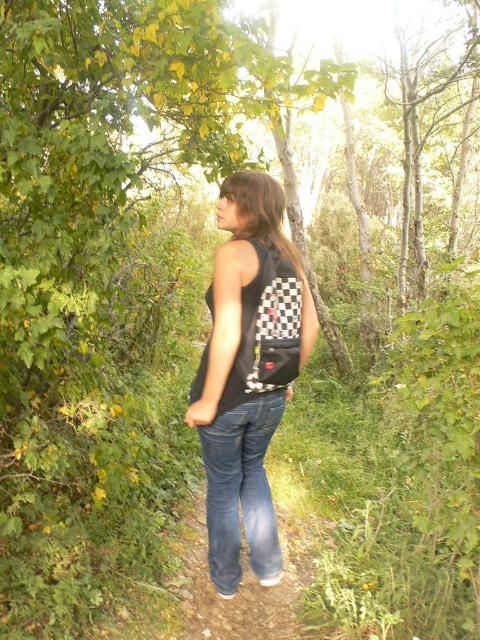
You are navigating a narrow dirt path in a forest. You see two points marked on your map at coordinates point (240, 477) and point (253, 387). If you are facing the direction the woman is looking, which point is closer to you?

Point (253, 387) is closer to you because it is in front of point (240, 477) when facing the direction the woman is looking.

You are a hiker who wants to ensure your backpack doesn not hit your head while walking. Based on the scene, which object is taller between the black checkered backpack at center and the denim at center?

The black checkered backpack at center is much taller than the denim at center, so it is more likely to hit your head while walking.

You are hiking on a narrow dirt path in a forest and see two points marked in the image. The first point is at coordinates point [235,454] and the second is at point [202,392]. If you are facing the direction the woman is looking, which point is farther away from you?

Point [235,454] is behind point [202,392], so if you are facing the direction the woman is looking, the point [235,454] is farther away from you.